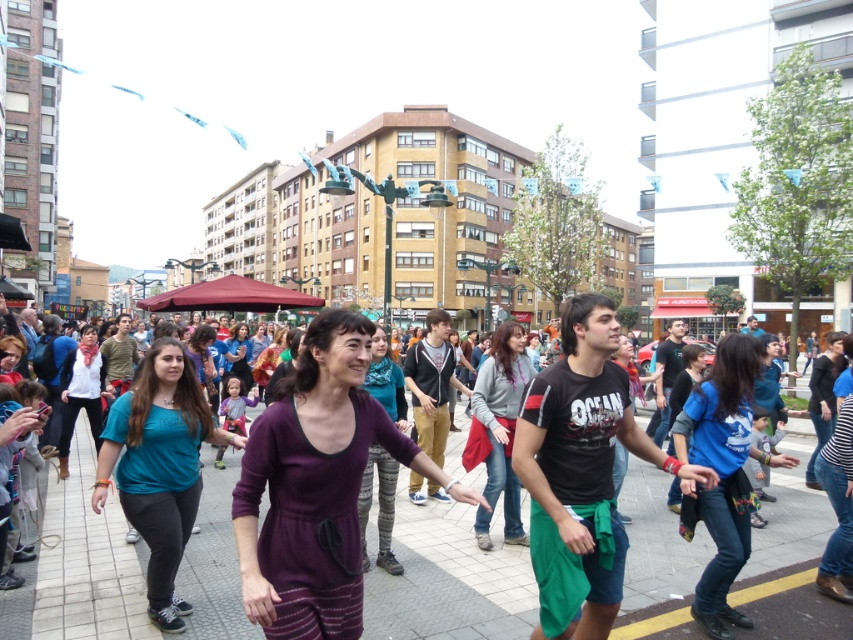
You are standing at the center of the scene and want to pick up the teal fabric shirt at center and the white matte scarf at center. Which item is closer to you?

Both the teal fabric shirt at center and the white matte scarf at center are at the same distance from you since they are both located at the center of the scene.

What is the color of the fabric at the point with coordinates (160,467)?

The point at coordinates (160,467) is on the teal fabric shirt at center.